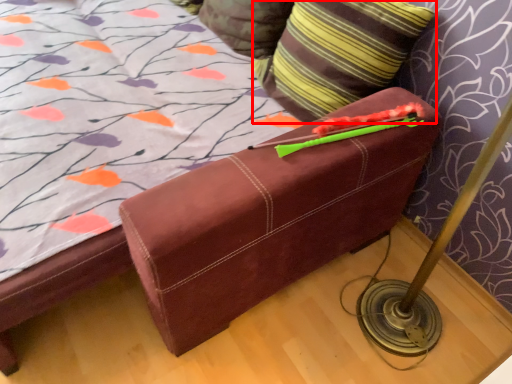
Question: From the image's perspective, considering the relative positions of pillow (annotated by the red box) and pillow in the image provided, where is pillow (annotated by the red box) located with respect to the staircase?

Choices:
 (A) above
 (B) below

Answer: (B)